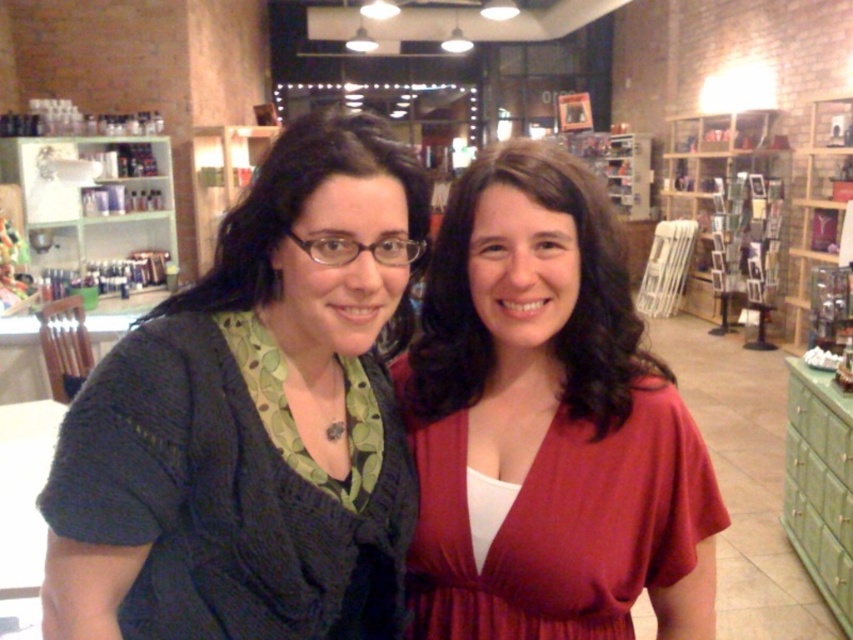
Between knitted dark gray sweater at left and wooden bookshelf at upper right, which one appears on the right side from the viewer's perspective?

From the viewer's perspective, wooden bookshelf at upper right appears more on the right side.

Does point (219, 580) come behind point (672, 212)?

No, it is not.

Locate an element on the screen. This screenshot has width=853, height=640. knitted dark gray sweater at left is located at coordinates (252, 420).

Which is above, knitted dark gray sweater at left or wooden bookshelf at right?

wooden bookshelf at right is above.

Does knitted dark gray sweater at left have a lesser height compared to wooden bookshelf at right?

Yes.

Is point (241, 452) positioned after point (785, 268)?

No.

Where is `knitted dark gray sweater at left`? The width and height of the screenshot is (853, 640). knitted dark gray sweater at left is located at coordinates (252, 420).

Looking at this image, can you confirm if matte red dress at center is positioned to the right of green glass shelves at upper left?

Indeed, matte red dress at center is positioned on the right side of green glass shelves at upper left.

What do you see at coordinates (546, 424) in the screenshot?
I see `matte red dress at center` at bounding box center [546, 424].

Which is in front, point (440, 342) or point (85, 147)?

Point (440, 342)

The image size is (853, 640). I want to click on matte red dress at center, so click(546, 424).